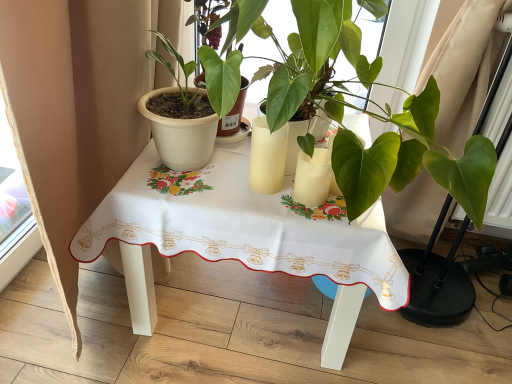
You are a GUI agent. You are given a task and a screenshot of the screen. Output one action in this format:
    pyautogui.click(x=<x>, y=<y>)
    Task: Click on the vacant area that is in front of matte white candle at center, positioned as the 1th candle holder in right-to-left order
    This screenshot has width=512, height=384.
    Given the screenshot: What is the action you would take?
    pyautogui.click(x=315, y=217)